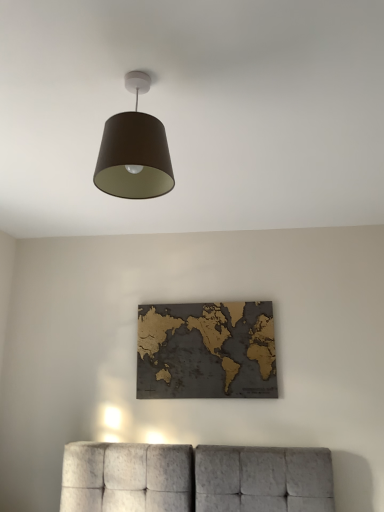
Identify the location of free point above gold textured map at center (from a real-world perspective). The width and height of the screenshot is (384, 512). (204, 302).